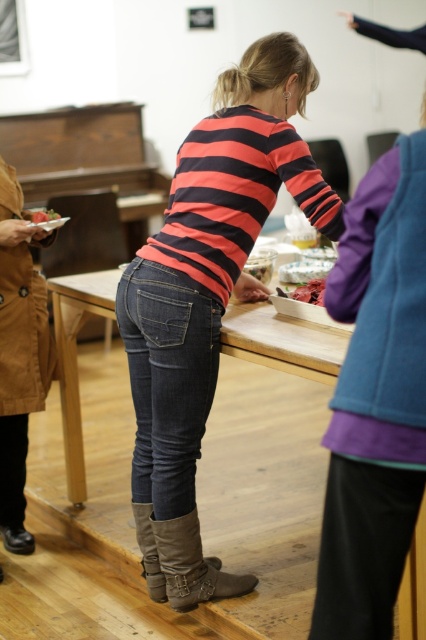
Question: Where is striped cotton shirt at center located in relation to suede boots at lower center in the image?

Choices:
 (A) left
 (B) right

Answer: (B)

Question: Which object is positioned farthest from the striped cotton shirt at center?

Choices:
 (A) leather boots at lower center
 (B) denim jeans at center

Answer: (A)

Question: Is wooden table at center to the left of suede boots at lower center from the viewer's perspective?

Choices:
 (A) no
 (B) yes

Answer: (B)

Question: Which object is the farthest from the leather boots at lower center?

Choices:
 (A) wooden table at center
 (B) dark red glossy meat at center
 (C) denim jeans at center

Answer: (B)

Question: Is dark blue denim jeans at center to the left of smooth red plate at center from the viewer's perspective?

Choices:
 (A) no
 (B) yes

Answer: (A)

Question: Estimate the real-world distances between objects in this image. Which object is closer to the leather boots at lower center?

Choices:
 (A) smooth red plate at center
 (B) dark blue denim jeans at center
 (C) wooden table at center

Answer: (B)